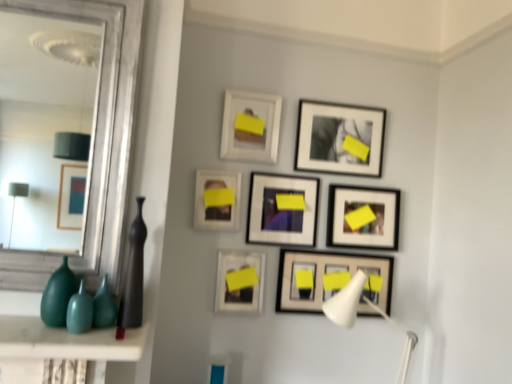
Question: Is matte white picture frame at center-left, the 3th picture frame positioned from the top, bigger than matte white picture frame at upper center, which is counted as the eighth picture frame, starting from the bottom?

Choices:
 (A) no
 (B) yes

Answer: (A)

Question: Does matte white picture frame at center-left, the 6th picture frame from the bottom, come behind matte white picture frame at upper center, the 1th picture frame positioned from the top?

Choices:
 (A) no
 (B) yes

Answer: (A)

Question: Can you confirm if matte white picture frame at center-left, the 6th picture frame from the bottom, is smaller than matte white picture frame at upper center, which is counted as the eighth picture frame, starting from the bottom?

Choices:
 (A) yes
 (B) no

Answer: (A)

Question: From a real-world perspective, is matte white picture frame at center-left, the 6th picture frame from the bottom, beneath matte white picture frame at upper center, the 1th picture frame positioned from the top?

Choices:
 (A) no
 (B) yes

Answer: (B)

Question: Considering the relative sizes of matte white picture frame at center-left, the 3th picture frame positioned from the top, and matte white picture frame at upper center, which is counted as the eighth picture frame, starting from the bottom, in the image provided, is matte white picture frame at center-left, the 3th picture frame positioned from the top, wider than matte white picture frame at upper center, which is counted as the eighth picture frame, starting from the bottom,?

Choices:
 (A) no
 (B) yes

Answer: (A)

Question: From a real-world perspective, is teal glossy vase at lower left, the first vase positioned from the front, physically located above or below teal glass vase at lower left, which is counted as the second glass vase, starting from the right?

Choices:
 (A) above
 (B) below

Answer: (B)

Question: From the image's perspective, is teal glossy vase at lower left, the second vase when ordered from back to front, positioned above or below teal glass vase at lower left, which is counted as the second glass vase, starting from the right?

Choices:
 (A) below
 (B) above

Answer: (A)

Question: Based on their positions, is teal glossy vase at lower left, which is counted as the 1th vase, starting from the left, located to the left or right of teal glass vase at lower left, which is counted as the second glass vase, starting from the right?

Choices:
 (A) right
 (B) left

Answer: (A)

Question: Is teal glossy vase at lower left, which is counted as the 1th vase, starting from the left, inside the boundaries of teal glass vase at lower left, which ranks as the 1th glass vase in left-to-right order, or outside?

Choices:
 (A) inside
 (B) outside

Answer: (B)

Question: In the image, is matte black picture frame at center, which is the fourth picture frame from top to bottom, on the left side or the right side of teal glossy vase at lower left, the second vase when ordered from back to front?

Choices:
 (A) left
 (B) right

Answer: (B)

Question: Is matte black picture frame at center, marked as the 5th picture frame in a bottom-to-top arrangement, inside the boundaries of teal glossy vase at lower left, placed as the 2th vase when sorted from right to left, or outside?

Choices:
 (A) outside
 (B) inside

Answer: (A)

Question: Is matte black picture frame at center, which is the fourth picture frame from top to bottom, wider or thinner than teal glossy vase at lower left, placed as the 2th vase when sorted from right to left?

Choices:
 (A) wide
 (B) thin

Answer: (B)

Question: From the image's perspective, is matte black picture frame at center, which is the fourth picture frame from top to bottom, positioned above or below teal glossy vase at lower left, the second vase when ordered from back to front?

Choices:
 (A) below
 (B) above

Answer: (B)

Question: Considering the positions of teal glossy vase at lower left, which is counted as the 1th vase, starting from the left, and matte black picture frame at center, the 2th picture frame from the bottom, in the image, is teal glossy vase at lower left, which is counted as the 1th vase, starting from the left, wider or thinner than matte black picture frame at center, the 2th picture frame from the bottom,?

Choices:
 (A) wide
 (B) thin

Answer: (A)

Question: Based on their sizes in the image, would you say teal glossy vase at lower left, placed as the 2th vase when sorted from right to left, is bigger or smaller than matte black picture frame at center, the 2th picture frame from the bottom?

Choices:
 (A) big
 (B) small

Answer: (A)